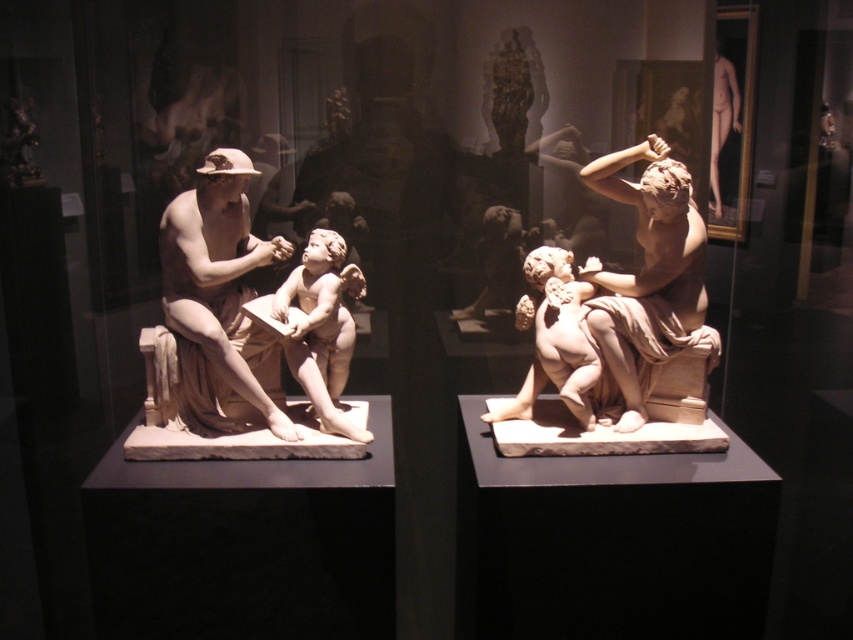
You are a visitor in the museum and want to take a photo of both the matte stone man at left and the matte beige statue at right. Since you can only take one photo, which sculpture should you position closer to the camera to include both in the frame without cropping?

Position the matte stone man at left closer to the camera because it is already to the left of the matte beige statue at right, allowing both to fit in the frame when centered.

You are an art curator planning to move the matte stone man at left and the matte beige statue at right to a new exhibition space. The entrance of the new space has a doorway that is 1.8 meters wide. Considering their sizes, can both sculptures fit through the doorway side by side?

The matte stone man at left is larger than the matte beige statue at right. However, since the question does not provide specific measurements of their widths, it is impossible to determine if they can fit through the 1.8 meter wide doorway side by side based on the given information.